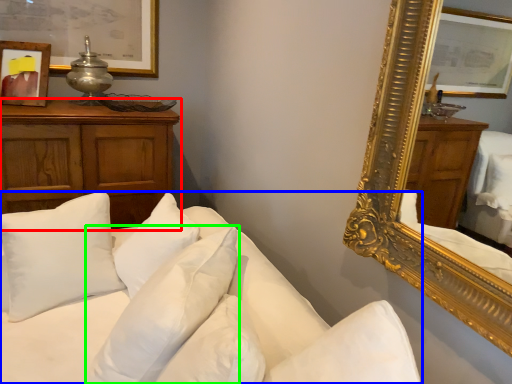
Question: Which is farther away from cabinetry (highlighted by a red box)? studio couch (highlighted by a blue box) or pillow (highlighted by a green box)?

Choices:
 (A) studio couch
 (B) pillow

Answer: (B)